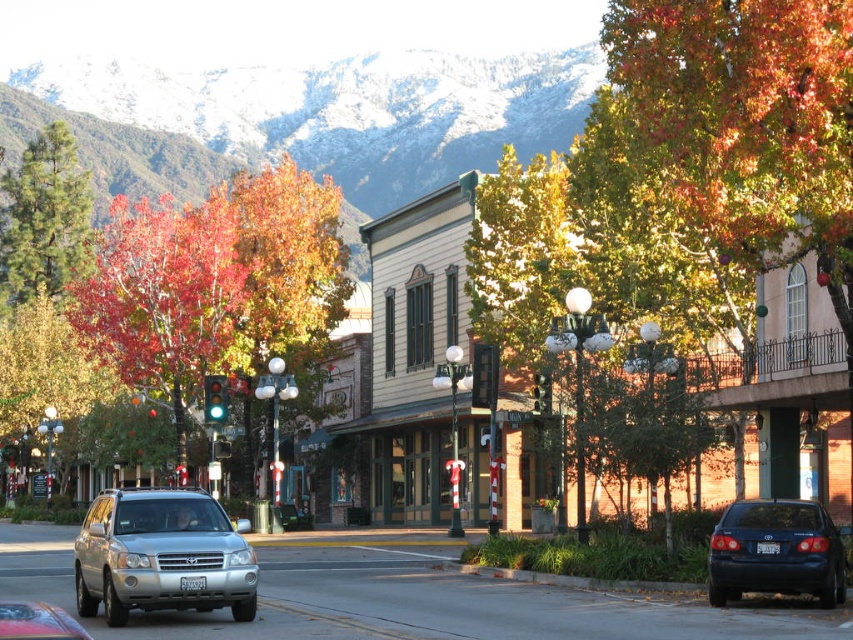
Question: Can you confirm if silver metallic suv at lower left is bigger than glossy dark blue sedan at lower right?

Choices:
 (A) no
 (B) yes

Answer: (B)

Question: Considering the real-world distances, which object is closest to the green matte pine tree at upper left?

Choices:
 (A) metallic silver suv at center
 (B) vivid red leaves at center

Answer: (B)

Question: Does snowy mountain at upper center have a larger size compared to glossy dark blue sedan at lower right?

Choices:
 (A) no
 (B) yes

Answer: (B)

Question: Among these points, which one is farthest from the camera?

Choices:
 (A) (752, 576)
 (B) (193, 532)
 (C) (41, 625)
 (D) (202, 113)

Answer: (D)

Question: Which point is closer to the camera?

Choices:
 (A) (227, 588)
 (B) (219, 220)

Answer: (A)

Question: Is vivid red leaves at center positioned in front of metallic silver suv at center?

Choices:
 (A) yes
 (B) no

Answer: (B)